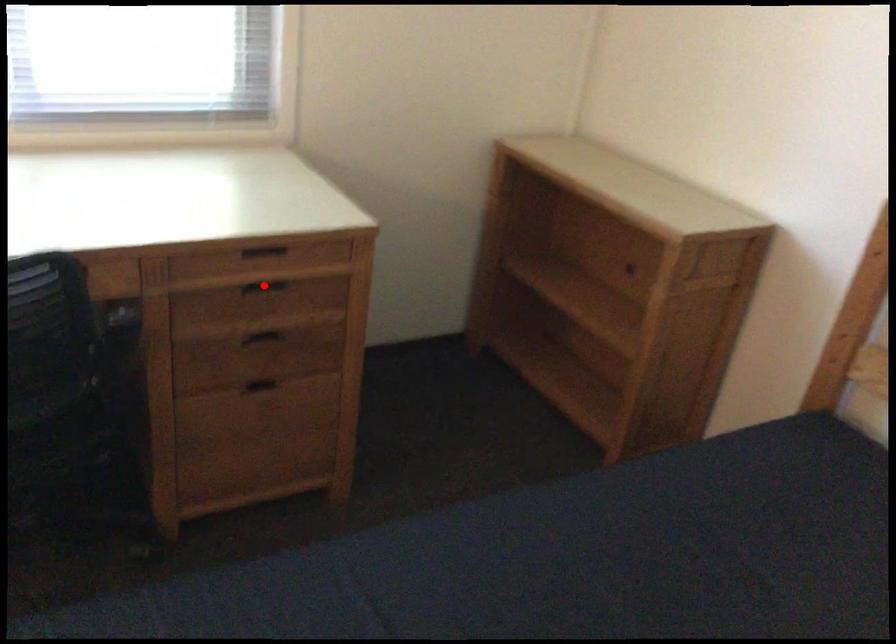
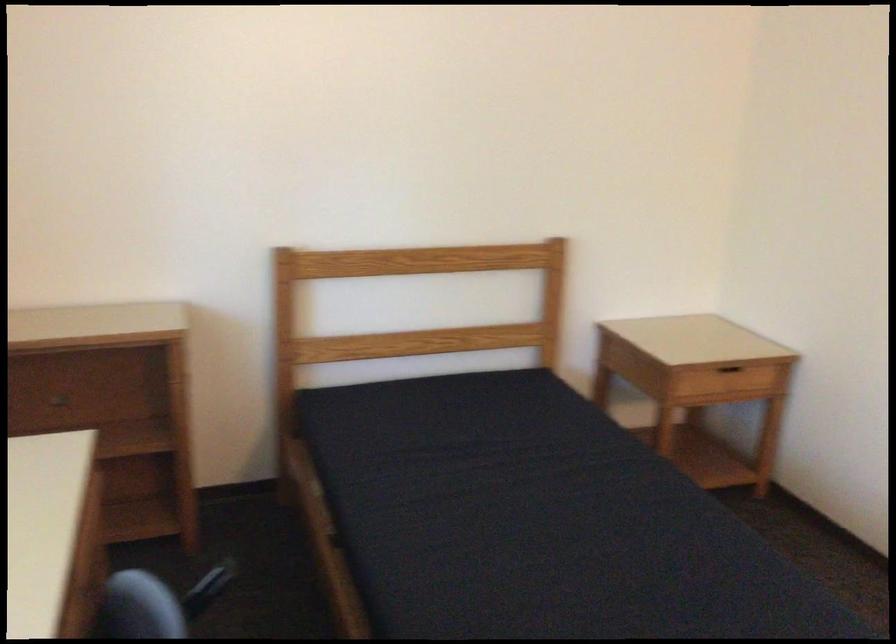
Question: I am providing you with two images of the same scene from different viewpoints. A red point is marked on the first image. Can you still see the location of the red point in image 2?

Choices:
 (A) Yes
 (B) No

Answer: (B)